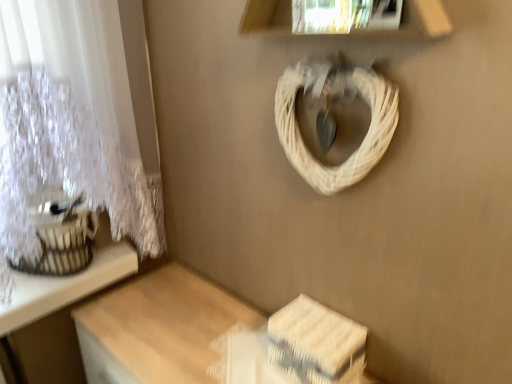
Question: Considering the positions of white lace curtain at upper left and white woven storage box at lower right in the image, is white lace curtain at upper left taller or shorter than white woven storage box at lower right?

Choices:
 (A) short
 (B) tall

Answer: (B)

Question: From the image's perspective, is white lace curtain at upper left above or below white woven storage box at lower right?

Choices:
 (A) above
 (B) below

Answer: (A)

Question: Which object is the farthest from the white wicker basket at upper center?

Choices:
 (A) white woven storage box at lower right
 (B) white lace curtain at upper left
 (C) wooden table at lower right

Answer: (C)

Question: Which is nearer to the wooden table at lower right?

Choices:
 (A) white wicker basket at upper center
 (B) white woven storage box at lower right
 (C) white lace curtain at upper left

Answer: (B)